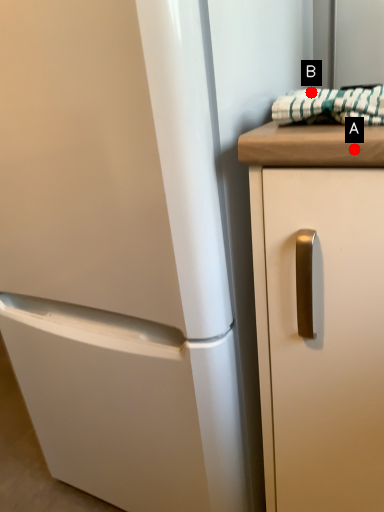
Question: Two points are circled on the image, labeled by A and B beside each circle. Which point appears farthest from the camera in this image?

Choices:
 (A) A is further
 (B) B is further

Answer: (B)